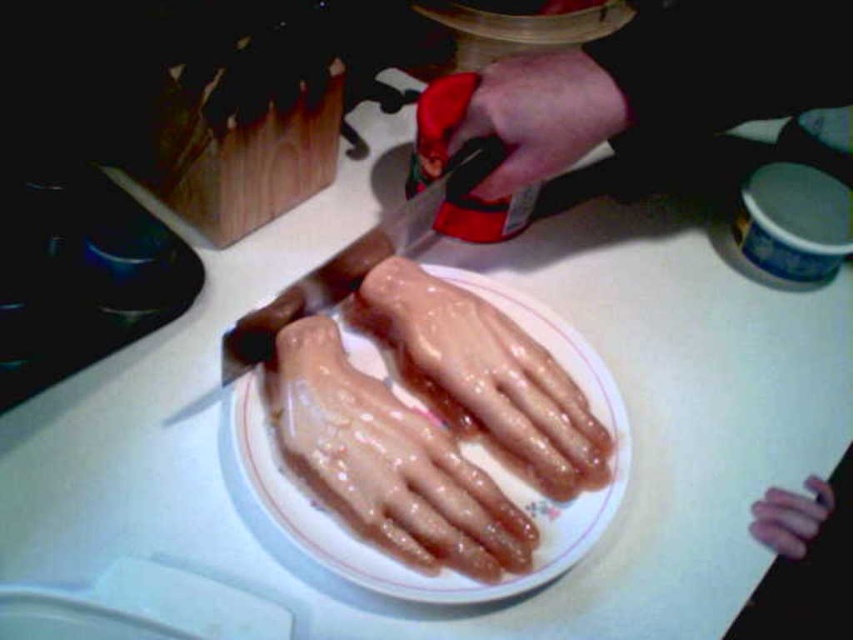
Who is positioned more to the left, black plastic knife at center or pink rubber hand at center?

black plastic knife at center is more to the left.

From the picture: Which of these two, black plastic knife at center or pink rubber hand at center, stands shorter?

pink rubber hand at center is shorter.

Find the location of a particular element. Image resolution: width=853 pixels, height=640 pixels. black plastic knife at center is located at coordinates (361, 257).

Between white glossy plate at center and glossy plastic hand at center, which one has more height?

white glossy plate at center is taller.

Based on the photo, who is positioned more to the left, white glossy plate at center or glossy plastic hand at center?

Positioned to the left is white glossy plate at center.

Which is behind, point (595, 362) or point (548, 429)?

Point (595, 362)

Where is `white glossy plate at center`? This screenshot has height=640, width=853. white glossy plate at center is located at coordinates (463, 454).

Based on the photo, is glossy plastic hand at center to the left of smooth skin hand at upper center from the viewer's perspective?

Indeed, glossy plastic hand at center is positioned on the left side of smooth skin hand at upper center.

Can you confirm if glossy plastic hand at center is positioned below smooth skin hand at upper center?

Indeed, glossy plastic hand at center is positioned under smooth skin hand at upper center.

Is point (593, 461) farther from viewer compared to point (602, 140)?

No, it is not.

Find the location of a particular element. This screenshot has width=853, height=640. glossy plastic hand at center is located at coordinates (486, 372).